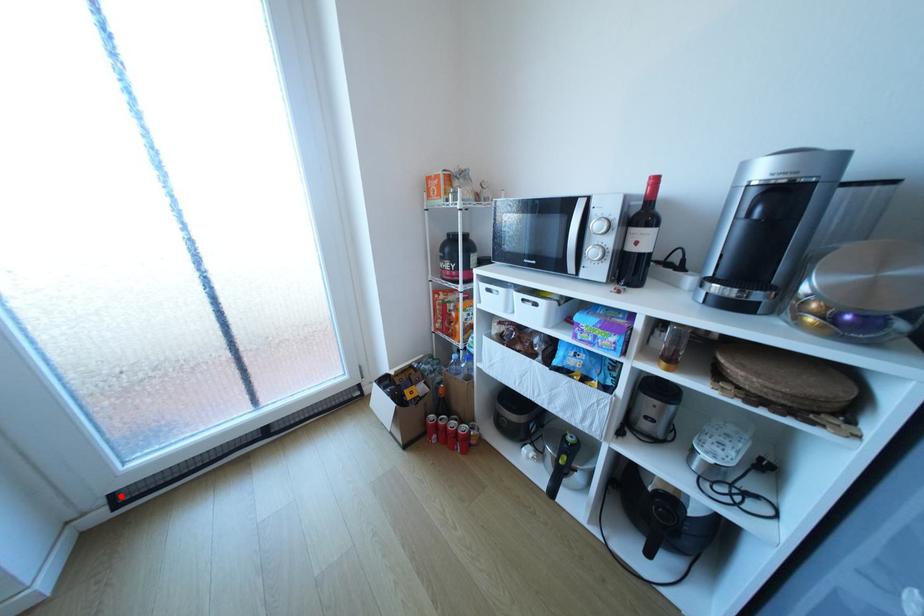
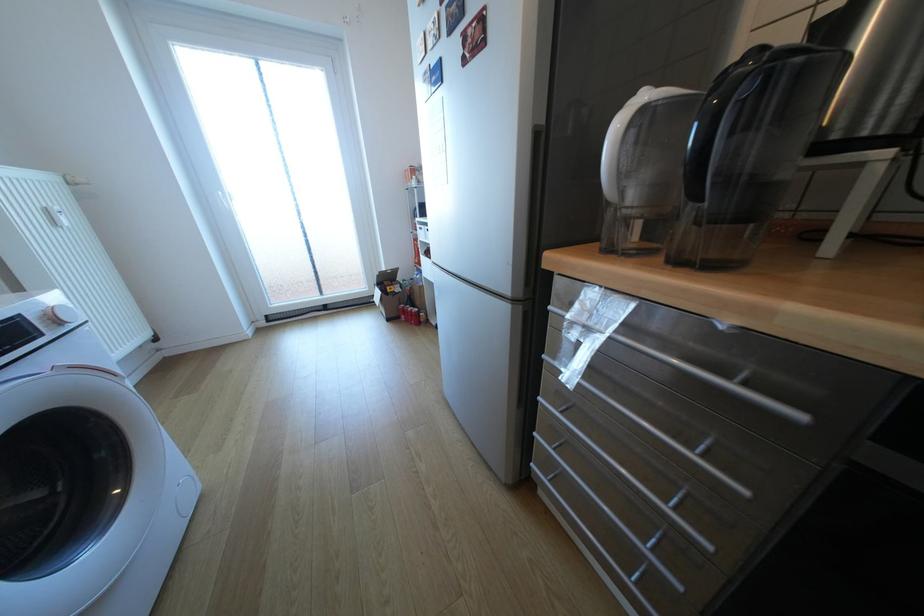
Find the pixel in the second image that matches the highlighted location in the first image.

(275, 315)